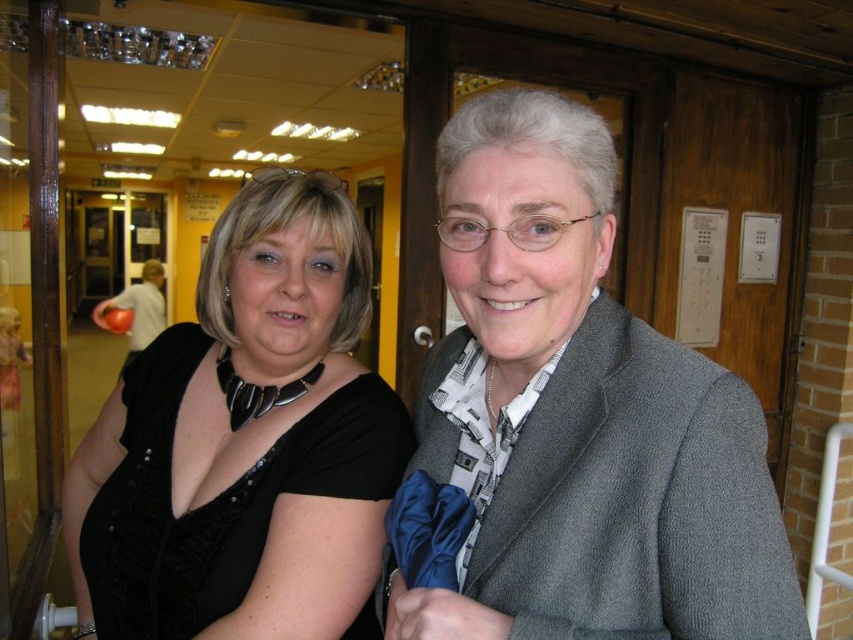
Question: Which object is farther from the camera taking this photo?

Choices:
 (A) gray woolen jacket at upper right
 (B) black satin dress at left

Answer: (B)

Question: Is gray woolen jacket at upper right behind black satin dress at left?

Choices:
 (A) yes
 (B) no

Answer: (B)

Question: Which object appears closest to the camera in this image?

Choices:
 (A) gray woolen jacket at upper right
 (B) black satin dress at left

Answer: (A)

Question: Does gray woolen jacket at upper right have a greater width compared to black satin dress at left?

Choices:
 (A) no
 (B) yes

Answer: (A)

Question: Is gray woolen jacket at upper right above black satin dress at left?

Choices:
 (A) yes
 (B) no

Answer: (A)